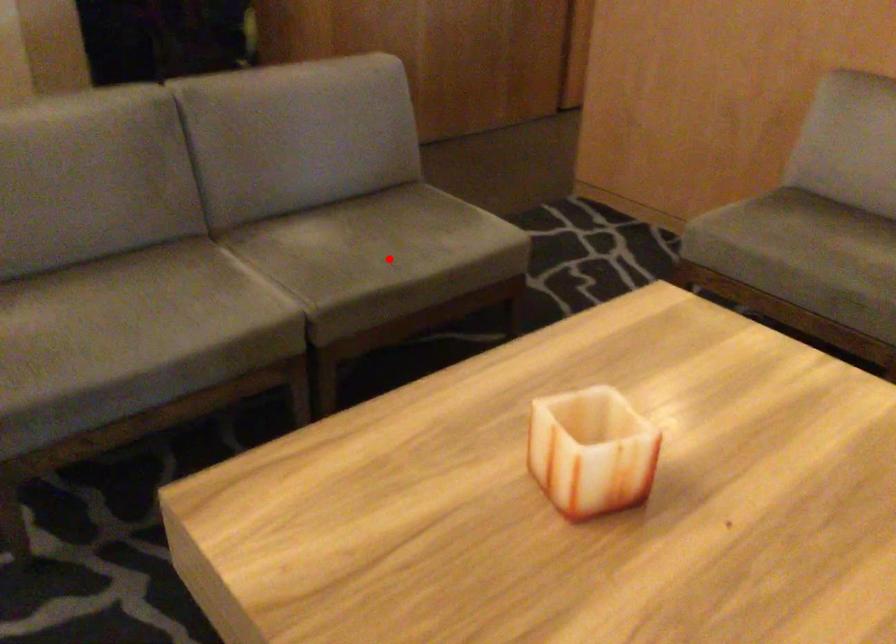
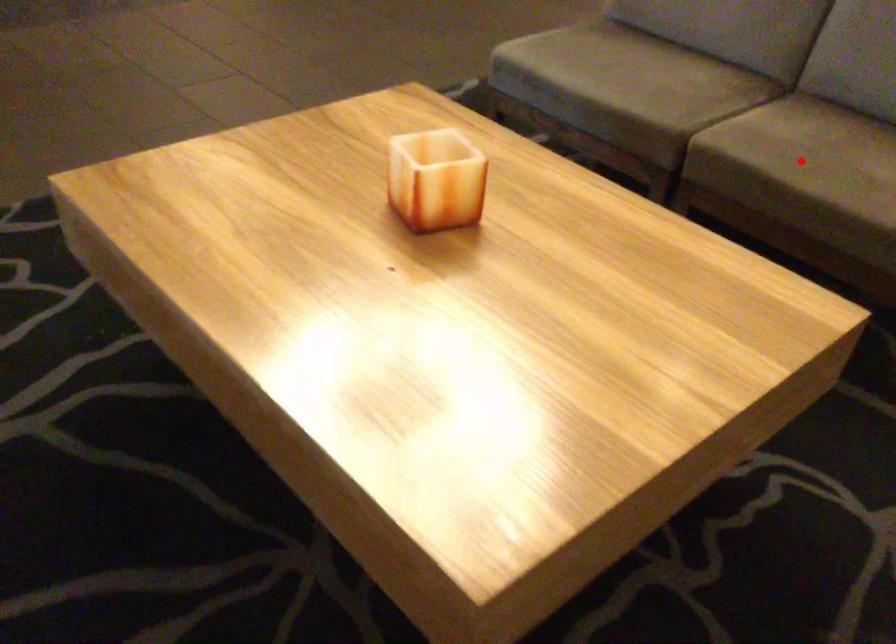
I am providing you with two images of the same scene from different viewpoints. A red point is marked on the first image and another point is marked on the second image. Are the points marked in image1 and image2 representing the same 3D position?

Yes